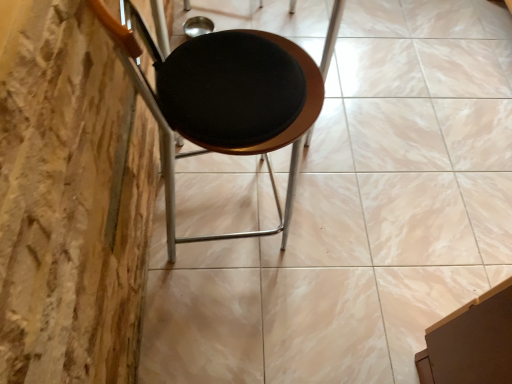
This screenshot has width=512, height=384. I want to click on matte black stool at center, so click(223, 138).

What is the approximate width of matte black stool at center?

matte black stool at center is 19.29 inches in width.

Describe the element at coordinates (223, 138) in the screenshot. I see `matte black stool at center` at that location.

What are the coordinates of `matte black stool at center` in the screenshot? It's located at (223, 138).